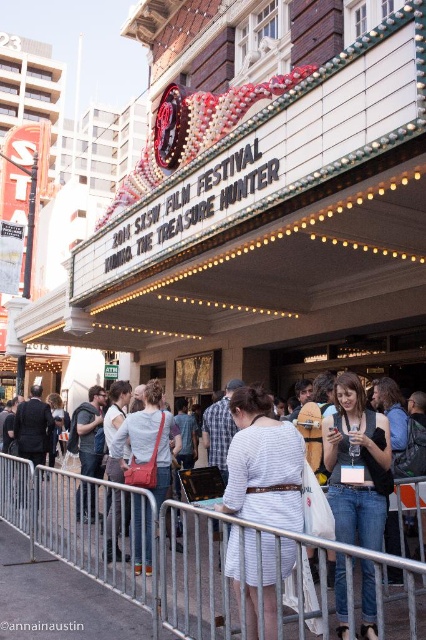
Which is above, silver metallic fence at center or dark gray suit at center?

Positioned higher is dark gray suit at center.

Who is positioned more to the left, silver metallic fence at center or dark gray suit at center?

dark gray suit at center is more to the left.

Find the location of a particular element. silver metallic fence at center is located at coordinates (126, 557).

Does light blue denim jeans at center appear on the right side of dark gray suit at center?

Correct, you'll find light blue denim jeans at center to the right of dark gray suit at center.

Which of these two, light blue denim jeans at center or dark gray suit at center, stands taller?

Standing taller between the two is light blue denim jeans at center.

This screenshot has width=426, height=640. Describe the element at coordinates (146, 444) in the screenshot. I see `light blue denim jeans at center` at that location.

Locate an element on the screen. The height and width of the screenshot is (640, 426). light blue denim jeans at center is located at coordinates (146, 444).

Who is taller, light blue denim jeans at center or dark gray hoodie at center?

With more height is light blue denim jeans at center.

Is light blue denim jeans at center to the right of dark gray hoodie at center from the viewer's perspective?

Yes, light blue denim jeans at center is to the right of dark gray hoodie at center.

Who is more forward, (x=152, y=429) or (x=81, y=440)?

Point (x=152, y=429) is in front.

This screenshot has width=426, height=640. Identify the location of light blue denim jeans at center. (146, 444).